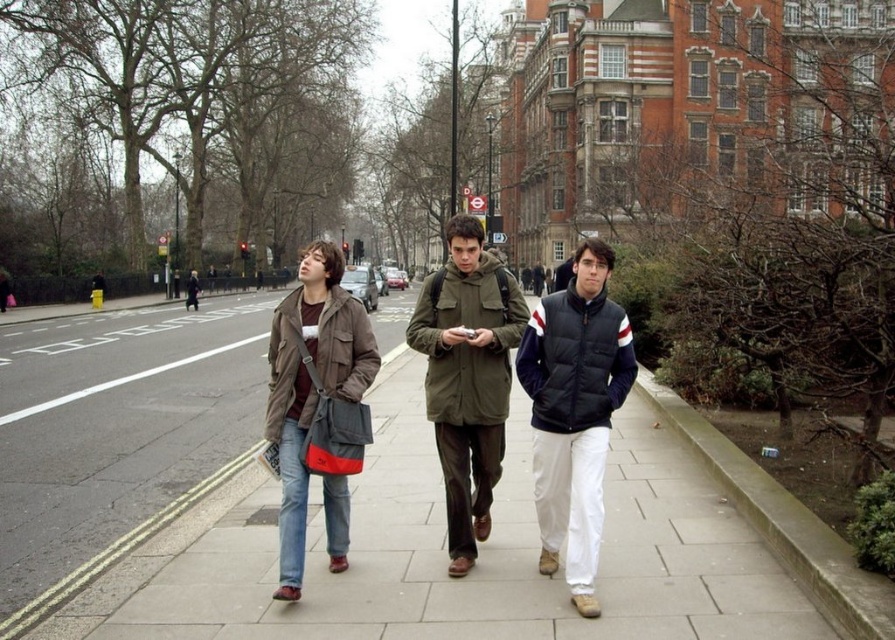
You are standing on the sidewalk and see a point marked at coordinates (680, 512). If you want to place a 10 meter long banner from your current position to that point, will it be long enough to reach?

The point at (680, 512) is 9.16 meters away from the viewer. Since the banner is 10 meters long, it will be long enough to reach the point.

You are a photographer trying to capture a candid shot of the two people in the center of the sidewalk scene. The subjects are wearing a dark blue quilted jacket at center and a brown textured jacket at center. Based on their positions, which one is closer to the ground?

The dark blue quilted jacket at center is below the brown textured jacket at center, so the dark blue quilted jacket at center is closer to the ground.